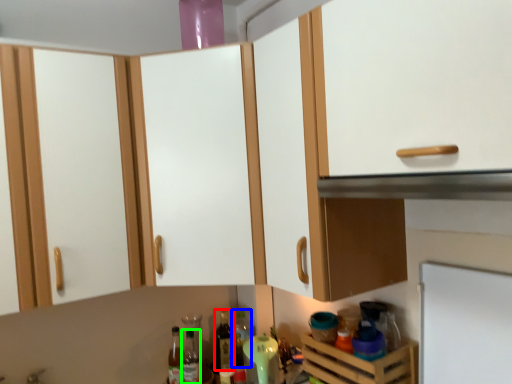
Question: Estimate the real-world distances between objects in this image. Which object is closer to bottle (highlighted by a red box), bottle (highlighted by a blue box) or bottle (highlighted by a green box)?

Choices:
 (A) bottle
 (B) bottle

Answer: (A)